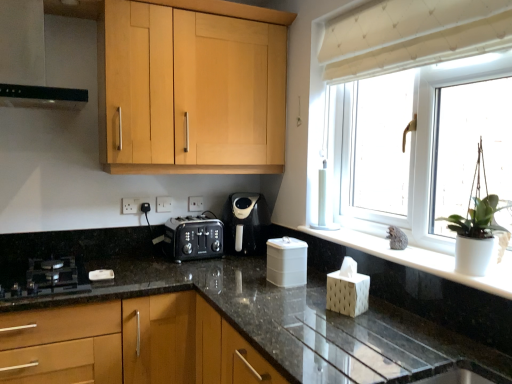
Find the location of `free region under white matte plant at right (from a real-world perspective)`. free region under white matte plant at right (from a real-world perspective) is located at coordinates (482, 278).